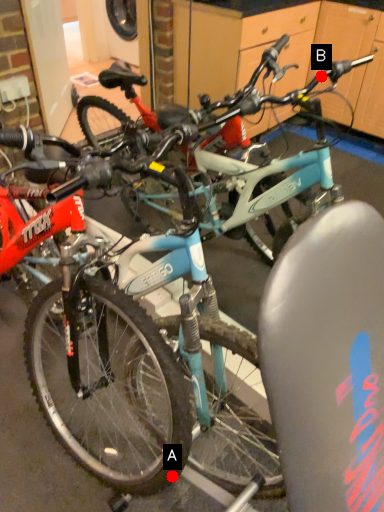
Question: Two points are circled on the image, labeled by A and B beside each circle. Which point is farther from the camera taking this photo?

Choices:
 (A) A is further
 (B) B is further

Answer: (B)